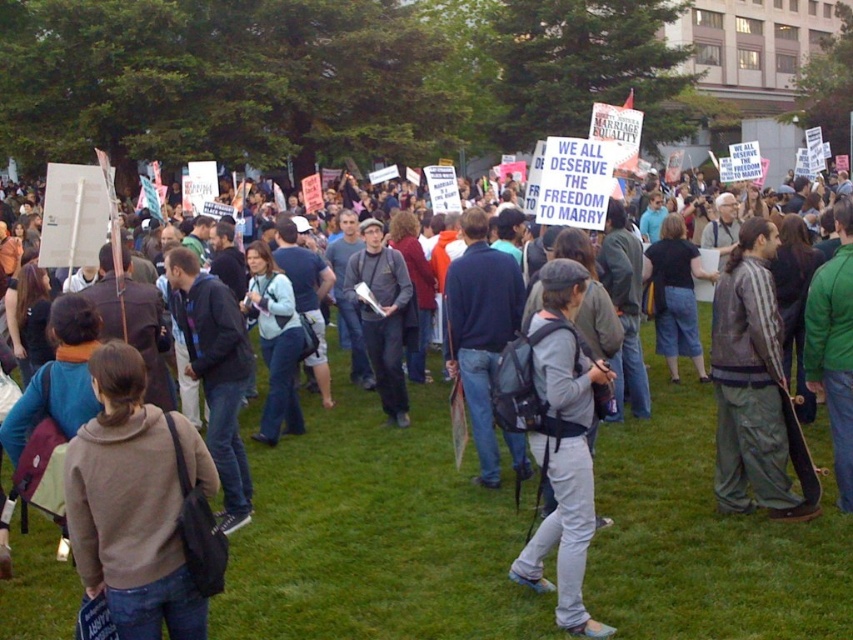
From the picture: You are standing at the point with coordinates (134, 502) in the image. What object are you standing on?

The point with coordinates (134, 502) is on the light brown hoodie at center.

You are standing in the park and want to walk from point (387, 364) to point (421, 417). Which direction should you move in to get closer to your destination?

To move from point (387, 364) to point (421, 417), you should move northeast because point (421, 417) is further to the viewer than point (387, 364).

You are a photographer trying to capture a clear photo of both the striped leather jacket at center and the matte gray jacket at center. Since you want to ensure both jackets are fully visible in the frame, which jacket should you focus on adjusting your camera angle to account for its height?

The striped leather jacket at center is shorter than the matte gray jacket at center, so you should adjust your camera angle to account for the height of the striped leather jacket at center to ensure it is fully visible.